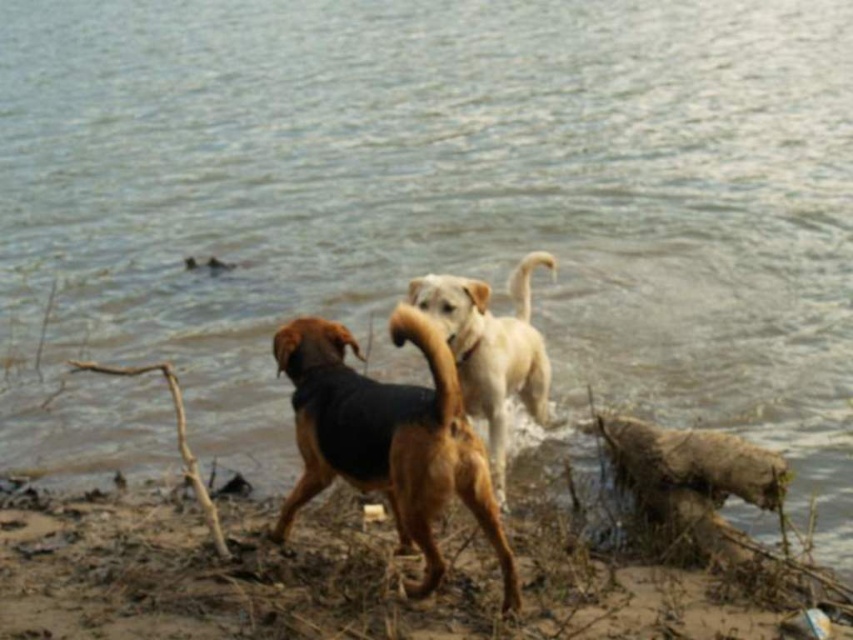
Question: Is brown fur dog at center to the left of light brown fur dog at center from the viewer's perspective?

Choices:
 (A) no
 (B) yes

Answer: (B)

Question: Can you confirm if brown fur dog at center is positioned to the left of light brown fur dog at center?

Choices:
 (A) yes
 (B) no

Answer: (A)

Question: Which point appears farthest from the camera in this image?

Choices:
 (A) (674, 573)
 (B) (492, 376)
 (C) (469, 492)

Answer: (B)

Question: Among these points, which one is farthest from the camera?

Choices:
 (A) (360, 536)
 (B) (312, 317)
 (C) (463, 288)

Answer: (C)

Question: Is brown dirt shoreline at lower left thinner than light brown fur dog at center?

Choices:
 (A) yes
 (B) no

Answer: (B)

Question: Which point is farther from the camera taking this photo?

Choices:
 (A) 492,572
 (B) 334,442

Answer: (A)